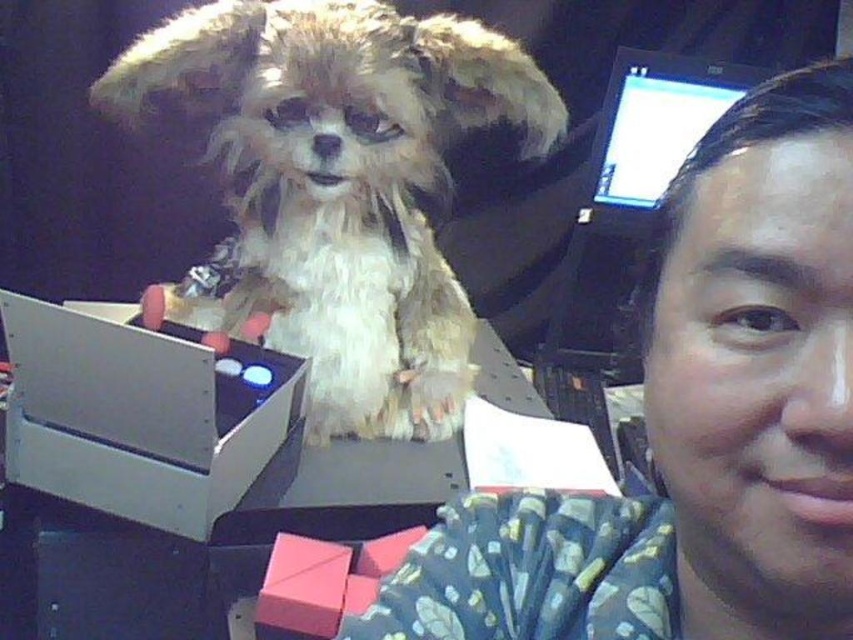
Is fuzzy beige dog at center behind matte black monitor at upper right?

No, fuzzy beige dog at center is in front of matte black monitor at upper right.

Is fuzzy beige dog at center thinner than matte black monitor at upper right?

No, fuzzy beige dog at center is not thinner than matte black monitor at upper right.

Between point (457, 362) and point (621, 172), which one is positioned behind?

The point (621, 172) is behind.

The height and width of the screenshot is (640, 853). In order to click on fuzzy beige dog at center in this screenshot , I will do `click(335, 186)`.

Between fluffy fur dog at upper left and matte black monitor at upper right, which one appears on the right side from the viewer's perspective?

Positioned to the right is matte black monitor at upper right.

Is fluffy fur dog at upper left above matte black monitor at upper right?

Actually, fluffy fur dog at upper left is below matte black monitor at upper right.

Describe the element at coordinates (695, 420) in the screenshot. I see `fluffy fur dog at upper left` at that location.

Locate an element on the screen. fluffy fur dog at upper left is located at coordinates (695, 420).

Which is more to the right, fluffy fur dog at upper left or fuzzy beige dog at center?

fluffy fur dog at upper left is more to the right.

Between fluffy fur dog at upper left and fuzzy beige dog at center, which one appears on the left side from the viewer's perspective?

fuzzy beige dog at center is more to the left.

I want to click on fluffy fur dog at upper left, so click(695, 420).